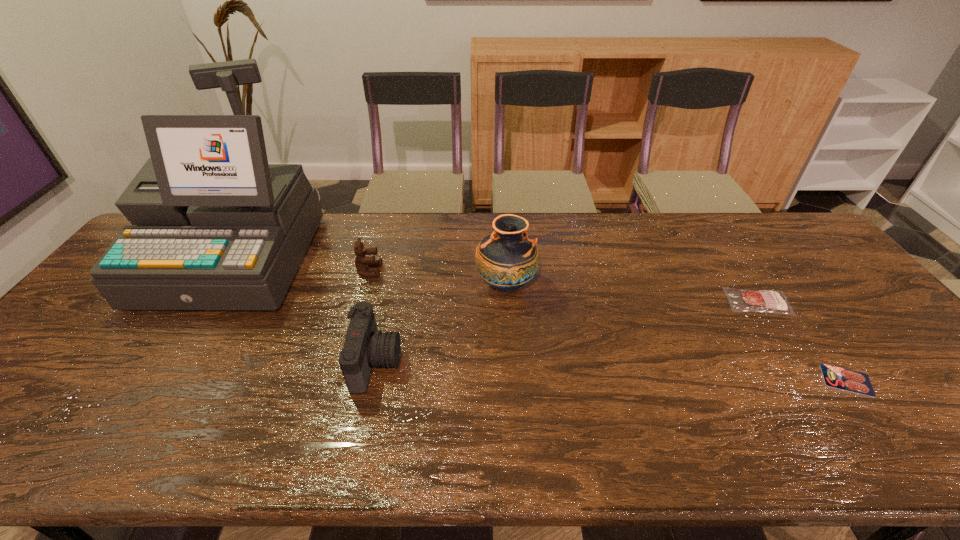
Identify the location of the tallest object. (218, 228).

The image size is (960, 540). In order to click on cash register in this screenshot , I will do `click(218, 228)`.

Locate an element on the screen. pottery is located at coordinates (507, 259).

Find the location of `the fourth object from left to right`. the fourth object from left to right is located at coordinates (507, 259).

Find the location of a particular element. The width and height of the screenshot is (960, 540). camera is located at coordinates (365, 347).

Where is `teddy bear`? The height and width of the screenshot is (540, 960). teddy bear is located at coordinates (362, 262).

This screenshot has height=540, width=960. In order to click on the fifth tallest object in this screenshot , I will do `click(740, 300)`.

Where is `the shortest object`? the shortest object is located at coordinates (849, 380).

Find the location of a particular element. The image size is (960, 540). free region located on the customer-facing side of the tallest object is located at coordinates (104, 460).

Where is `blank space located 0.190m on the right of the third object from right to left`? blank space located 0.190m on the right of the third object from right to left is located at coordinates click(602, 285).